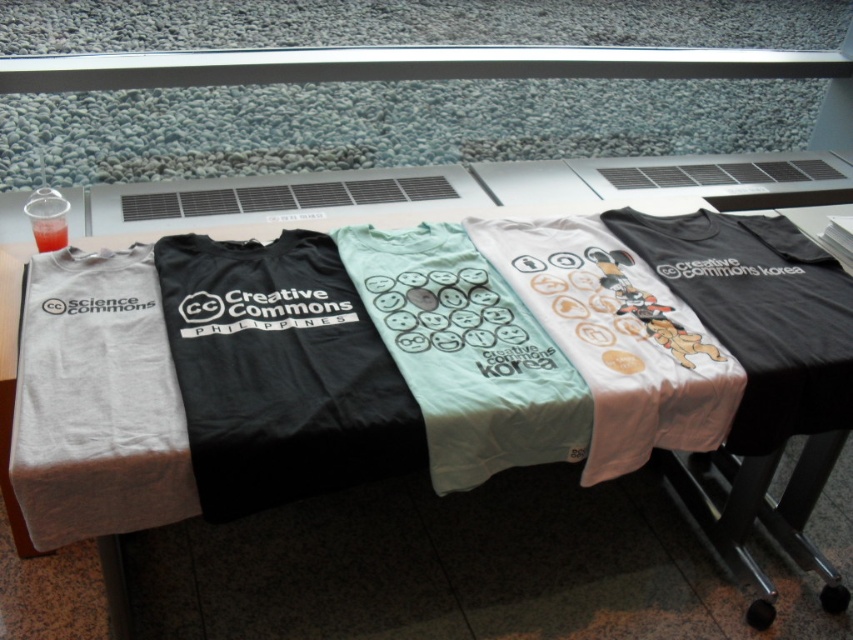
Question: Considering the relative positions of gray cotton t-shirt at left and translucent plastic cup at upper left in the image provided, where is gray cotton t-shirt at left located with respect to translucent plastic cup at upper left?

Choices:
 (A) below
 (B) above

Answer: (A)

Question: Which object is the closest to the black matte t-shirt at center?

Choices:
 (A) translucent plastic cup at upper left
 (B) light blue cotton t-shirt at center
 (C) gray cotton t-shirt at left

Answer: (C)

Question: Is white cotton t-shirt at center wider than black matte t-shirt at center?

Choices:
 (A) yes
 (B) no

Answer: (A)

Question: Is light blue cotton t-shirt at center positioned at the back of translucent plastic cup at upper left?

Choices:
 (A) yes
 (B) no

Answer: (B)

Question: Which of these objects is positioned farthest from the black matte t-shirt at center?

Choices:
 (A) white cotton t-shirt at center
 (B) light blue cotton t-shirt at center
 (C) gray cotton t-shirt at left
 (D) translucent plastic cup at upper left

Answer: (D)

Question: Which point is farther to the camera?

Choices:
 (A) black matte t-shirt at center
 (B) light blue cotton t-shirt at center

Answer: (B)